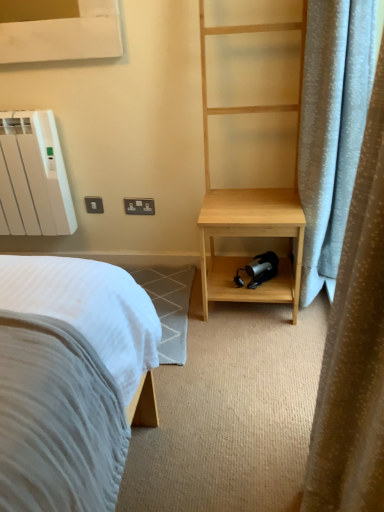
This screenshot has height=512, width=384. What are the coordinates of `free spot in front of natural wood bookshelf at right` in the screenshot? It's located at (247, 352).